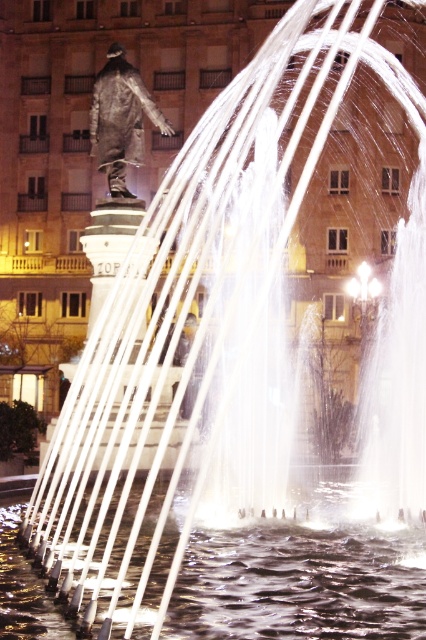
Question: Considering the relative positions of clear liquid water at center and bronze statue at upper left in the image provided, where is clear liquid water at center located with respect to bronze statue at upper left?

Choices:
 (A) left
 (B) right

Answer: (B)

Question: Is clear liquid water at center below bronze statue at upper left?

Choices:
 (A) no
 (B) yes

Answer: (B)

Question: In this image, where is clear liquid water at center located relative to bronze statue at upper left?

Choices:
 (A) right
 (B) left

Answer: (A)

Question: Which point is closer to the camera taking this photo?

Choices:
 (A) (106, 64)
 (B) (17, 547)

Answer: (B)